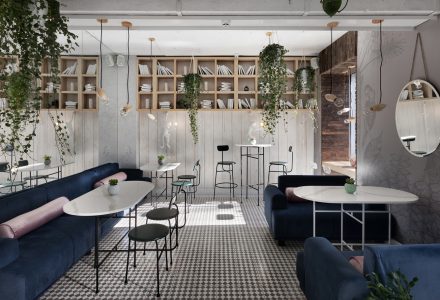
At what (x,y) coordinates should I click in order to perform the action: click on chairs. Please return your answer as a coordinate pair (x, y). Looking at the image, I should click on (152, 230), (160, 210), (184, 182), (192, 175), (224, 159), (276, 160), (10, 183), (37, 175).